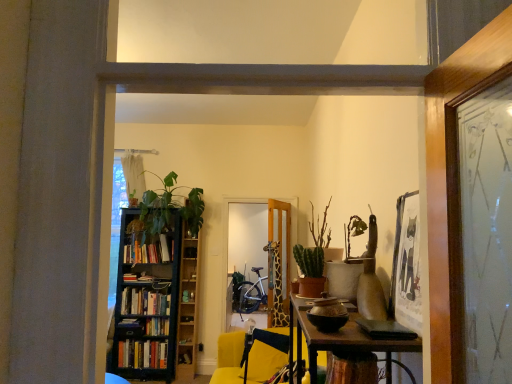
The width and height of the screenshot is (512, 384). Describe the element at coordinates (278, 263) in the screenshot. I see `wooden giraffe at center` at that location.

Image resolution: width=512 pixels, height=384 pixels. What do you see at coordinates (152, 300) in the screenshot?
I see `black wooden bookcase at left` at bounding box center [152, 300].

What is the approximate height of green matte plant at center?

It is 18.50 inches.

What do you see at coordinates (309, 260) in the screenshot? I see `green matte cactus at center-right, which ranks as the first plant in right-to-left order` at bounding box center [309, 260].

Locate an element on the screen. The image size is (512, 384). yellow fabric chair at center is located at coordinates (229, 359).

Describe the element at coordinates (149, 251) in the screenshot. The width and height of the screenshot is (512, 384). I see `hardcover books at left, the first book viewed from the top` at that location.

What do you see at coordinates (144, 302) in the screenshot? I see `hardcover books at left, which is counted as the third book, starting from the bottom` at bounding box center [144, 302].

Find the location of a particular element. The image size is (512, 384). wooden giraffe at center is located at coordinates (278, 263).

From the image's perspective, which is above, black wooden bookcase at left or hardcover books at left, positioned as the 2th book in top-to-bottom order?

black wooden bookcase at left, from the image's perspective.

Is black wooden bookcase at left far from hardcover books at left, which is counted as the third book, starting from the bottom?

No, black wooden bookcase at left is not far away from hardcover books at left, which is counted as the third book, starting from the bottom.

What's the angular difference between black wooden bookcase at left and hardcover books at left, positioned as the 2th book in top-to-bottom order,'s facing directions?

There is a 0.532-degree angle between the facing directions of black wooden bookcase at left and hardcover books at left, positioned as the 2th book in top-to-bottom order.

Is green matte plant at center facing towards wooden giraffe at center?

No.

From the image's perspective, is green matte plant at center positioned above or below wooden giraffe at center?

green matte plant at center is situated higher than wooden giraffe at center in the image.

Which object is thinner, green matte plant at center or wooden giraffe at center?

With smaller width is green matte plant at center.

From a real-world perspective, who is located higher, yellow fabric chair at center or hardcover books at left, positioned as the 2th book in top-to-bottom order?

From a 3D spatial view, hardcover books at left, positioned as the 2th book in top-to-bottom order, is above.

Where is `the 2nd book positioned above the yellow fabric chair at center (from a real-world perspective)`? The image size is (512, 384). the 2nd book positioned above the yellow fabric chair at center (from a real-world perspective) is located at coordinates (144, 302).

Looking at this image, from the image's perspective, between yellow fabric chair at center and hardcover books at left, positioned as the 2th book in top-to-bottom order, who is located below?

From the image's view, yellow fabric chair at center is below.

Looking at this image, is hardcover books at left, positioned as the 2th book in top-to-bottom order, surrounded by yellow fabric chair at center?

No.

In terms of width, does green matte plant at center look wider or thinner when compared to black wooden bookcase at left?

Considering their sizes, green matte plant at center looks slimmer than black wooden bookcase at left.

Can you confirm if green matte plant at center is smaller than black wooden bookcase at left?

Correct, green matte plant at center occupies less space than black wooden bookcase at left.

Is green matte plant at center turned away from black wooden bookcase at left?

No, black wooden bookcase at left is not at the back of green matte plant at center.

Can you confirm if green matte plant at center is shorter than black wooden bookcase at left?

Correct, green matte plant at center is not as tall as black wooden bookcase at left.

Is green matte plant at left, arranged as the second plant when viewed from the right, positioned with its back to hardcover books at left, acting as the first book starting from the bottom?

No, hardcover books at left, acting as the first book starting from the bottom, is not at the back of green matte plant at left, arranged as the second plant when viewed from the right.

In the scene shown: From the image's perspective, between green matte plant at left, arranged as the 1th plant when viewed from the left, and hardcover books at left, acting as the first book starting from the bottom, who is located below?

From the image's view, hardcover books at left, acting as the first book starting from the bottom, is below.

Who is bigger, green matte plant at left, arranged as the 1th plant when viewed from the left, or hardcover books at left, acting as the first book starting from the bottom?

green matte plant at left, arranged as the 1th plant when viewed from the left, is bigger.

Considering the sizes of hardcover books at left, positioned as the 2th book in top-to-bottom order, and hardcover books at left, the 4th book in the bottom-to-top sequence, in the image, is hardcover books at left, positioned as the 2th book in top-to-bottom order, wider or thinner than hardcover books at left, the 4th book in the bottom-to-top sequence,?

hardcover books at left, positioned as the 2th book in top-to-bottom order, is thinner than hardcover books at left, the 4th book in the bottom-to-top sequence.

Considering the sizes of hardcover books at left, which is counted as the third book, starting from the bottom, and hardcover books at left, the 4th book in the bottom-to-top sequence, in the image, is hardcover books at left, which is counted as the third book, starting from the bottom, bigger or smaller than hardcover books at left, the 4th book in the bottom-to-top sequence,?

Clearly, hardcover books at left, which is counted as the third book, starting from the bottom, is smaller in size than hardcover books at left, the 4th book in the bottom-to-top sequence.

Choose the correct answer: Is hardcover books at left, positioned as the 2th book in top-to-bottom order, inside hardcover books at left, the first book viewed from the top, or outside it?

hardcover books at left, positioned as the 2th book in top-to-bottom order, is outside hardcover books at left, the first book viewed from the top.

From a real-world perspective, which is physically above, hardcover books at left, which is counted as the third book, starting from the bottom, or hardcover books at left, the first book viewed from the top?

hardcover books at left, the first book viewed from the top, is physically above.

From the picture: Is green matte cactus at center-right, acting as the first plant starting from the front, facing towards hardcover books at left, acting as the first book starting from the bottom?

No.

Would you say green matte cactus at center-right, marked as the second plant in a left-to-right arrangement, is to the left or to the right of hardcover books at left, acting as the first book starting from the bottom, in the picture?

green matte cactus at center-right, marked as the second plant in a left-to-right arrangement, is to the right of hardcover books at left, acting as the first book starting from the bottom.

Considering the relative sizes of green matte cactus at center-right, marked as the second plant in a left-to-right arrangement, and hardcover books at left, acting as the first book starting from the bottom, in the image provided, is green matte cactus at center-right, marked as the second plant in a left-to-right arrangement, shorter than hardcover books at left, acting as the first book starting from the bottom,?

Yes.

Which object is thinner, green matte cactus at center-right, marked as the second plant in a left-to-right arrangement, or hardcover books at left, acting as the fourth book starting from the top?

green matte cactus at center-right, marked as the second plant in a left-to-right arrangement, is thinner.

In order to click on bookcase located in front of the hardcover books at left, positioned as the 2th book in top-to-bottom order in this screenshot , I will do `click(152, 300)`.

There is a wooden giraffe at center. At what (x,y) coordinates should I click in order to perform the action: click on houseplant above it (from a real-world perspective). Please return your answer as a coordinate pair (x, y). The image size is (512, 384). Looking at the image, I should click on (313, 257).

Considering their positions, is hardcover books at left, acting as the fourth book starting from the top, positioned further to wooden bookshelf at center-left than green matte plant at center?

green matte plant at center.

When comparing their distances from green matte cactus at center-right, which ranks as the first plant in right-to-left order, does wooden giraffe at center or hardcover books at left, positioned as the 2th book in top-to-bottom order, seem closer?

The object closer to green matte cactus at center-right, which ranks as the first plant in right-to-left order, is wooden giraffe at center.

Looking at this image, based on their spatial positions, is yellow fabric chair at center or green matte plant at center closer to wooden giraffe at center?

yellow fabric chair at center is closer to wooden giraffe at center.

Considering their positions, is green matte plant at center positioned further to green matte plant at left, arranged as the second plant when viewed from the right, than hardcover books at left, the 4th book in the bottom-to-top sequence?

green matte plant at center is positioned further to the anchor green matte plant at left, arranged as the second plant when viewed from the right.

Which object lies nearer to the anchor point green matte cactus at center-right, acting as the first plant starting from the front, hardcover books at left, which is counted as the third book, starting from the bottom, or hardcover book at left, the 3th book from the top?

hardcover books at left, which is counted as the third book, starting from the bottom, is positioned closer to the anchor green matte cactus at center-right, acting as the first plant starting from the front.

Estimate the real-world distances between objects in this image. Which object is closer to green matte plant at left, arranged as the 2th plant when viewed from the front, hardcover books at left, acting as the fourth book starting from the top, or black wooden bookcase at left?

Based on the image, black wooden bookcase at left appears to be nearer to green matte plant at left, arranged as the 2th plant when viewed from the front.

Considering their positions, is hardcover books at left, the first book viewed from the top, positioned closer to green matte plant at center than wooden bookshelf at center-left?

wooden bookshelf at center-left is closer to green matte plant at center.

Which object lies nearer to the anchor point wooden bookshelf at center-left, green matte plant at left, arranged as the 2th plant when viewed from the front, or black wooden bookcase at left?

Among the two, black wooden bookcase at left is located nearer to wooden bookshelf at center-left.

Locate an element on the screen. bookcase located between green matte plant at center and hardcover books at left, which is counted as the third book, starting from the bottom, in the depth direction is located at coordinates (152, 300).

At what (x,y) coordinates should I click in order to perform the action: click on chair between green matte cactus at center-right, marked as the second plant in a left-to-right arrangement, and wooden bookshelf at center-left from front to back. Please return your answer as a coordinate pair (x, y). The height and width of the screenshot is (384, 512). Looking at the image, I should click on (229, 359).

At what (x,y) coordinates should I click in order to perform the action: click on chair positioned between green matte plant at center and wooden giraffe at center from near to far. Please return your answer as a coordinate pair (x, y). Image resolution: width=512 pixels, height=384 pixels. Looking at the image, I should click on (229, 359).

At what (x,y) coordinates should I click in order to perform the action: click on bookcase between hardcover books at left, which is counted as the third book, starting from the bottom, and wooden giraffe at center. Please return your answer as a coordinate pair (x, y). This screenshot has height=384, width=512. Looking at the image, I should click on (152, 300).